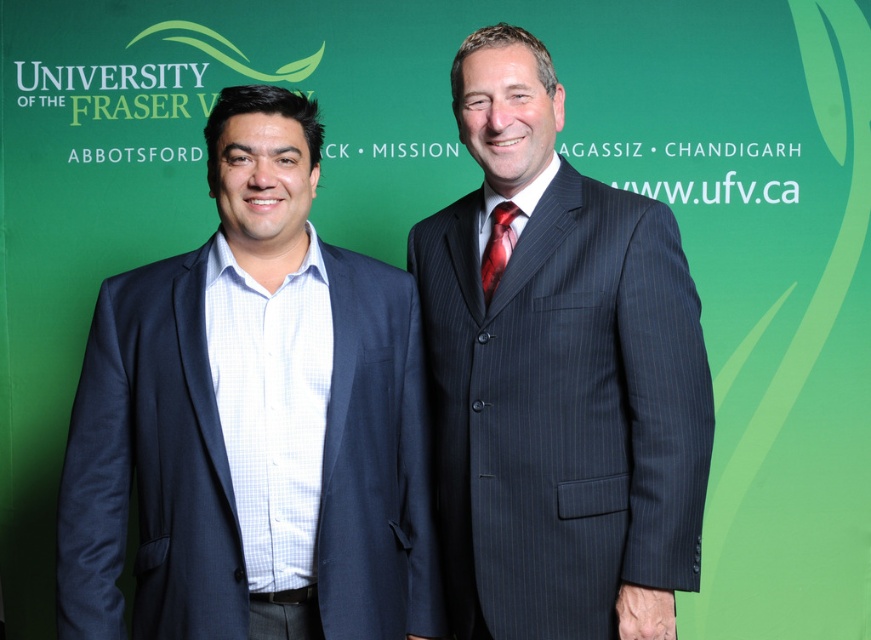
Question: Among these points, which one is farthest from the camera?

Choices:
 (A) (637, 481)
 (B) (393, 472)
 (C) (491, 237)

Answer: (C)

Question: Considering the relative positions of navy blue suit at left and shiny silk tie at center in the image provided, where is navy blue suit at left located with respect to shiny silk tie at center?

Choices:
 (A) right
 (B) left

Answer: (B)

Question: Can you confirm if navy blue suit at left is positioned above pinstriped suit at center?

Choices:
 (A) no
 (B) yes

Answer: (A)

Question: Is pinstriped suit at center to the right of shiny silk tie at center from the viewer's perspective?

Choices:
 (A) no
 (B) yes

Answer: (B)

Question: Among these objects, which one is farthest from the camera?

Choices:
 (A) navy blue suit at left
 (B) shiny silk tie at center
 (C) pinstriped suit at center

Answer: (B)

Question: Based on their relative distances, which object is nearer to the shiny silk tie at center?

Choices:
 (A) navy blue suit at left
 (B) pinstriped suit at center

Answer: (B)